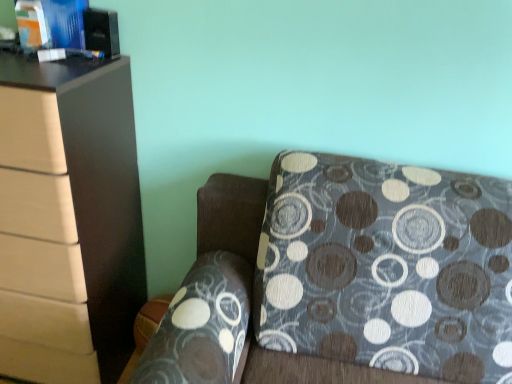
Question: From a real-world perspective, is matte blue book at upper left, which appears as the 1th book when viewed from the left, physically located above or below patterned fabric couch at lower right?

Choices:
 (A) above
 (B) below

Answer: (A)

Question: Do you think matte blue book at upper left, which appears as the 1th book when viewed from the left, is within patterned fabric couch at lower right, or outside of it?

Choices:
 (A) inside
 (B) outside

Answer: (B)

Question: Considering the real-world distances, which object is farthest from the matte brown chest of drawers at left?

Choices:
 (A) blue glossy book at upper left, the 2th book positioned from the left
 (B) patterned fabric couch at lower right
 (C) matte blue book at upper left, which appears as the 1th book when viewed from the left

Answer: (B)

Question: Considering the real-world distances, which object is farthest from the matte blue book at upper left, which is counted as the 2th book, starting from the right?

Choices:
 (A) patterned fabric couch at lower right
 (B) blue glossy book at upper left, the 2th book positioned from the left
 (C) matte brown chest of drawers at left

Answer: (A)